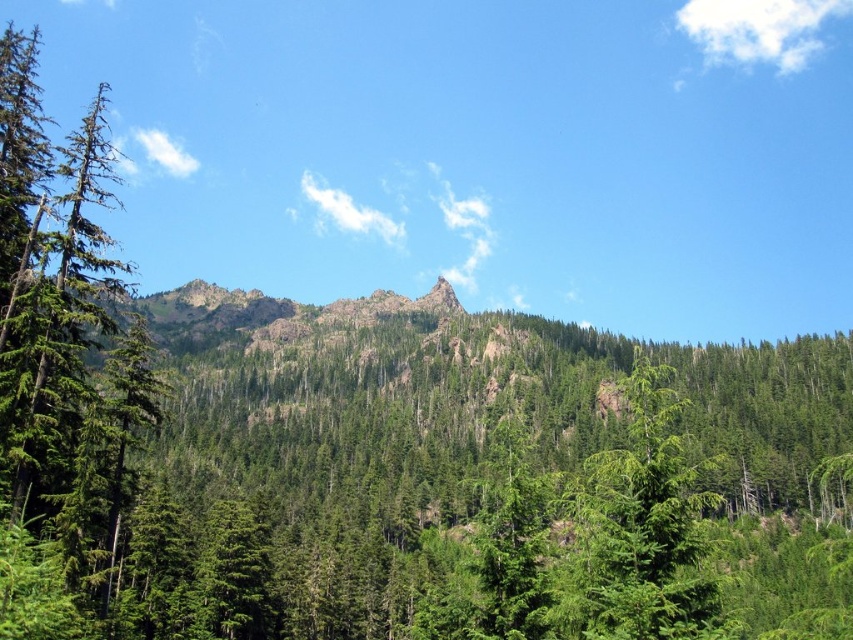
Is point (10, 134) less distant than point (642, 404)?

No.

Is green matte tree at left to the right of green matte tree at center from the viewer's perspective?

In fact, green matte tree at left is to the left of green matte tree at center.

Locate an element on the screen. The height and width of the screenshot is (640, 853). green matte tree at left is located at coordinates (53, 321).

At what (x,y) coordinates should I click in order to perform the action: click on green matte tree at left. Please return your answer as a coordinate pair (x, y). Looking at the image, I should click on (53, 321).